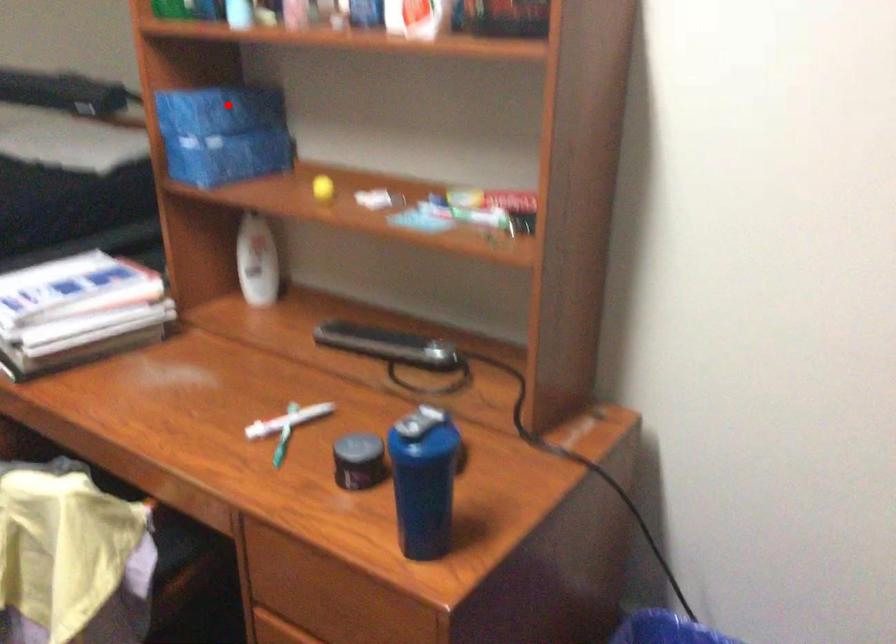
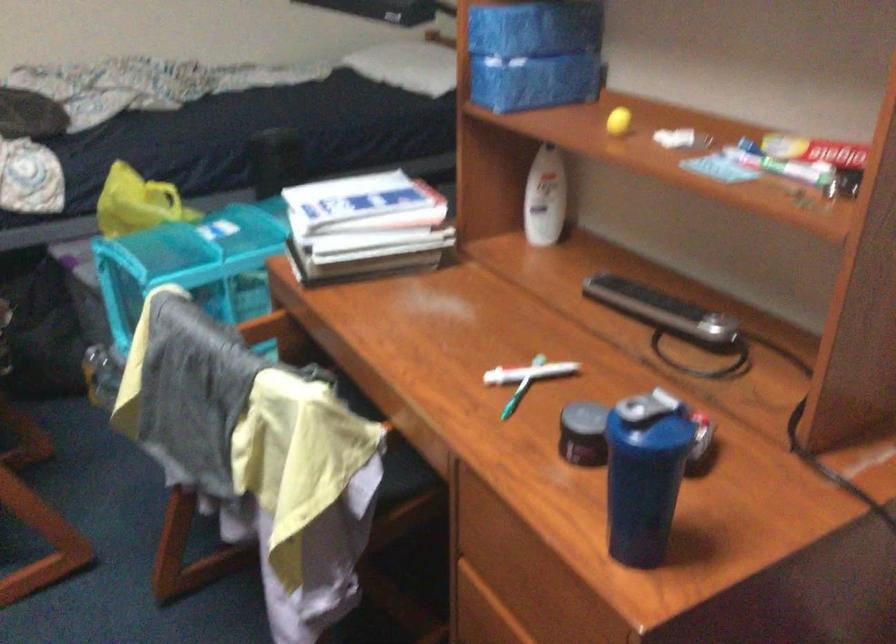
In the second image, find the point that corresponds to the highlighted location in the first image.

(536, 26)